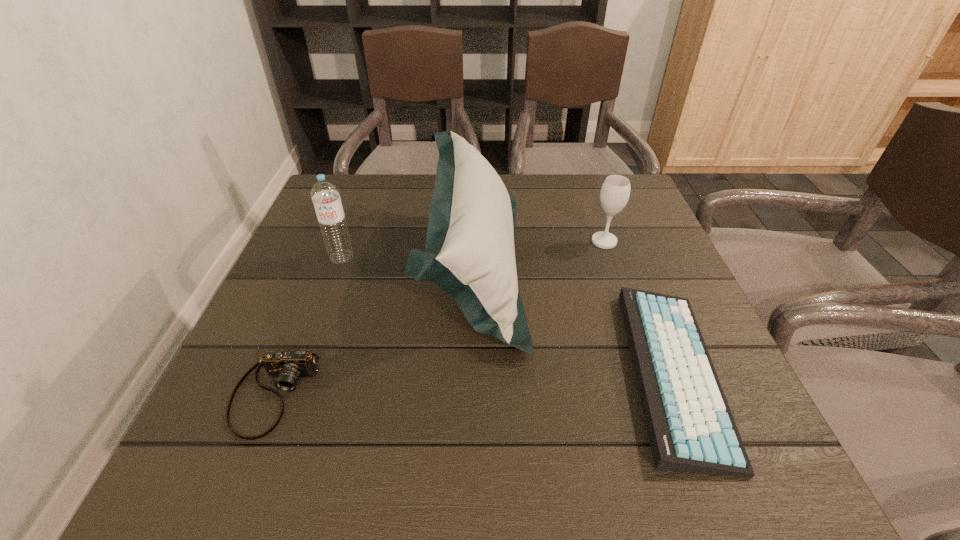
The width and height of the screenshot is (960, 540). Find the location of `free space between the wineglass and the fourth tallest object`. free space between the wineglass and the fourth tallest object is located at coordinates tap(440, 318).

Where is `empty location between the second shortest object and the cushion`? empty location between the second shortest object and the cushion is located at coordinates (374, 328).

The width and height of the screenshot is (960, 540). I want to click on the closest object relative to the shortest object, so click(x=469, y=253).

At what (x,y) coordinates should I click in order to perform the action: click on object that is the third closest to the second shortest object. Please return your answer as a coordinate pair (x, y). Looking at the image, I should click on (691, 429).

Image resolution: width=960 pixels, height=540 pixels. What are the coordinates of `vacant space that satisfies the following two spatial constraints: 1. on the surface of the third object from right to left; 2. on the front-facing side of the camera` in the screenshot? It's located at (472, 394).

Locate an element on the screen. The image size is (960, 540). vacant point that satisfies the following two spatial constraints: 1. on the front side of the shortest object; 2. on the left side of the wineglass is located at coordinates (649, 372).

Identify the location of free space that satisfies the following two spatial constraints: 1. on the surface of the third object from left to right; 2. on the front-facing side of the camera. Image resolution: width=960 pixels, height=540 pixels. (472, 394).

You are a GUI agent. You are given a task and a screenshot of the screen. Output one action in this format:
    pyautogui.click(x=<x>, y=<y>)
    Task: Click on the vacant area that satisfies the following two spatial constraints: 1. on the surface of the third object from left to right; 2. on the back side of the shortest object
    Image resolution: width=960 pixels, height=540 pixels.
    Given the screenshot: What is the action you would take?
    pyautogui.click(x=473, y=372)